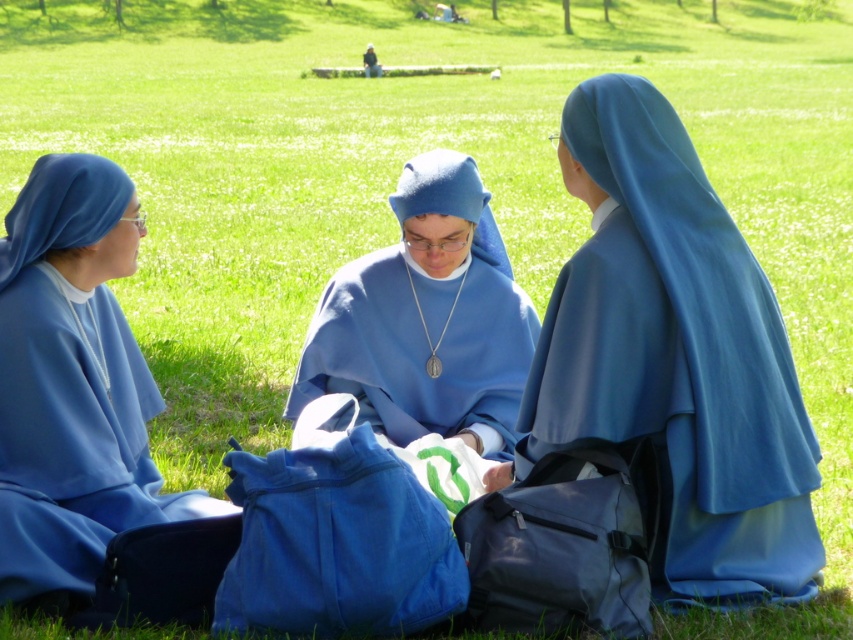
Does blue matte robe at center have a larger size compared to matte blue robe at left?

Actually, blue matte robe at center might be smaller than matte blue robe at left.

Can you confirm if blue matte robe at center is positioned to the left of matte blue robe at left?

Incorrect, blue matte robe at center is not on the left side of matte blue robe at left.

Is point (798, 513) positioned behind point (80, 352)?

Yes.

The image size is (853, 640). I want to click on blue matte robe at center, so click(677, 358).

Can you confirm if blue matte robe at center is positioned to the right of matte blue robe at center?

Yes, blue matte robe at center is to the right of matte blue robe at center.

Between blue matte robe at center and matte blue robe at center, which one is positioned higher?

matte blue robe at center

What are the coordinates of `blue matte robe at center` in the screenshot? It's located at (677, 358).

Can you confirm if matte blue robe at left is thinner than matte blue robe at center?

Indeed, matte blue robe at left has a lesser width compared to matte blue robe at center.

Based on the photo, does matte blue robe at left appear under matte blue robe at center?

Correct, matte blue robe at left is located below matte blue robe at center.

You are a GUI agent. You are given a task and a screenshot of the screen. Output one action in this format:
    pyautogui.click(x=<x>, y=<y>)
    Task: Click on the matte blue robe at left
    This screenshot has height=640, width=853.
    Given the screenshot: What is the action you would take?
    pyautogui.click(x=73, y=381)

Identify the location of matte blue robe at left. The height and width of the screenshot is (640, 853). (73, 381).